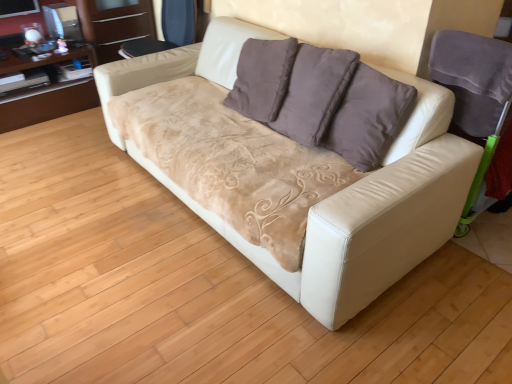
Question: Considering the positions of point (423, 243) and point (110, 11), is point (423, 243) closer or farther from the camera than point (110, 11)?

Choices:
 (A) farther
 (B) closer

Answer: (B)

Question: Is white leather couch at center situated inside matte brown wood dresser at upper left, placed as the 1th dresser when sorted from right to left, or outside?

Choices:
 (A) outside
 (B) inside

Answer: (A)

Question: Estimate the real-world distances between objects in this image. Which object is farther from the white leather couch at center?

Choices:
 (A) matte brown wood dresser at upper left, placed as the 1th dresser when sorted from right to left
 (B) white leather armchair at right, which appears as the 1th armchair when viewed from the front
 (C) velvet dark blue armchair at upper center, arranged as the first armchair when viewed from the left
 (D) brown wood dresser at upper left, the 2th dresser positioned from the right

Answer: (A)

Question: Estimate the real-world distances between objects in this image. Which object is closer to the brown wood dresser at upper left, the 2th dresser positioned from the right?

Choices:
 (A) white leather couch at center
 (B) velvet dark blue armchair at upper center, arranged as the first armchair when viewed from the left
 (C) matte brown wood dresser at upper left, placed as the 1th dresser when sorted from right to left
 (D) white leather armchair at right, the second armchair when ordered from left to right

Answer: (C)